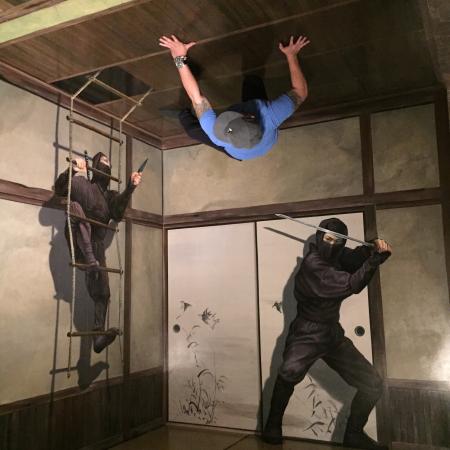
I want to click on wooden floor, so pyautogui.click(x=187, y=439).